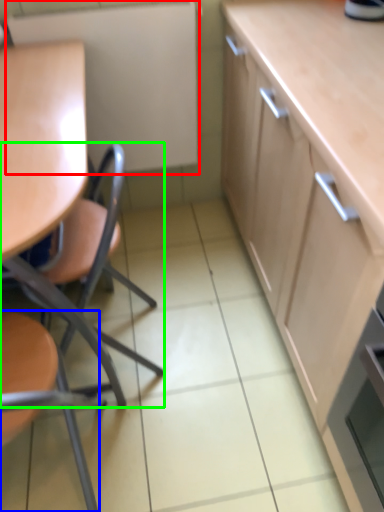
Question: Which object is positioned farthest from appliance (highlighted by a red box)? Select from chair (highlighted by a blue box) and chair (highlighted by a green box).

Choices:
 (A) chair
 (B) chair

Answer: (A)